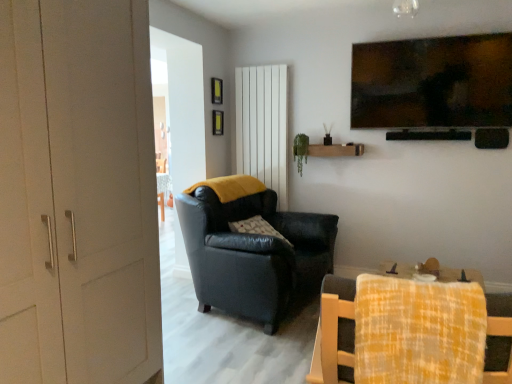
Question: Would you say yellow plaid fabric at lower right, which is the first chair in front-to-back order, is part of white matte door at left's contents?

Choices:
 (A) yes
 (B) no

Answer: (B)

Question: Is white matte door at left further to the viewer compared to yellow plaid fabric at lower right, which is the first chair in front-to-back order?

Choices:
 (A) yes
 (B) no

Answer: (A)

Question: Considering the relative sizes of white matte door at left and yellow plaid fabric at lower right, which is the first chair in front-to-back order, in the image provided, is white matte door at left wider than yellow plaid fabric at lower right, which is the first chair in front-to-back order,?

Choices:
 (A) no
 (B) yes

Answer: (B)

Question: Considering the relative sizes of white matte door at left and yellow plaid fabric at lower right, which is the first chair in front-to-back order, in the image provided, is white matte door at left smaller than yellow plaid fabric at lower right, which is the first chair in front-to-back order,?

Choices:
 (A) no
 (B) yes

Answer: (A)

Question: Considering the relative positions of white matte door at left and yellow plaid fabric at lower right, which is the first chair in front-to-back order, in the image provided, is white matte door at left in front of yellow plaid fabric at lower right, which is the first chair in front-to-back order,?

Choices:
 (A) yes
 (B) no

Answer: (B)

Question: Would you say leather armchair at center, which ranks as the 1th chair in back-to-front order, is to the left or to the right of yellow plaid fabric at lower right, which is the first chair in front-to-back order, in the picture?

Choices:
 (A) right
 (B) left

Answer: (B)

Question: From the image's perspective, is leather armchair at center, which ranks as the second chair in front-to-back order, above or below yellow plaid fabric at lower right, arranged as the 2th chair when viewed from the back?

Choices:
 (A) above
 (B) below

Answer: (A)

Question: Looking at the image, does leather armchair at center, which ranks as the second chair in front-to-back order, seem bigger or smaller compared to yellow plaid fabric at lower right, which is the first chair in front-to-back order?

Choices:
 (A) small
 (B) big

Answer: (B)

Question: From a real-world perspective, is leather armchair at center, which ranks as the second chair in front-to-back order, above or below yellow plaid fabric at lower right, arranged as the 2th chair when viewed from the back?

Choices:
 (A) below
 (B) above

Answer: (A)

Question: From the image's perspective, is white vertical panel at center above or below plush gray pillow at center?

Choices:
 (A) below
 (B) above

Answer: (B)

Question: Looking at the image, does white vertical panel at center seem bigger or smaller compared to plush gray pillow at center?

Choices:
 (A) big
 (B) small

Answer: (B)

Question: Considering the positions of point (254, 134) and point (234, 223), is point (254, 134) closer or farther from the camera than point (234, 223)?

Choices:
 (A) farther
 (B) closer

Answer: (A)

Question: Do you think white vertical panel at center is within plush gray pillow at center, or outside of it?

Choices:
 (A) outside
 (B) inside

Answer: (A)

Question: Is white vertical panel at center inside or outside of leather armchair at center, which ranks as the 1th chair in back-to-front order?

Choices:
 (A) outside
 (B) inside

Answer: (A)

Question: Is white vertical panel at center taller or shorter than leather armchair at center, which ranks as the second chair in front-to-back order?

Choices:
 (A) short
 (B) tall

Answer: (B)